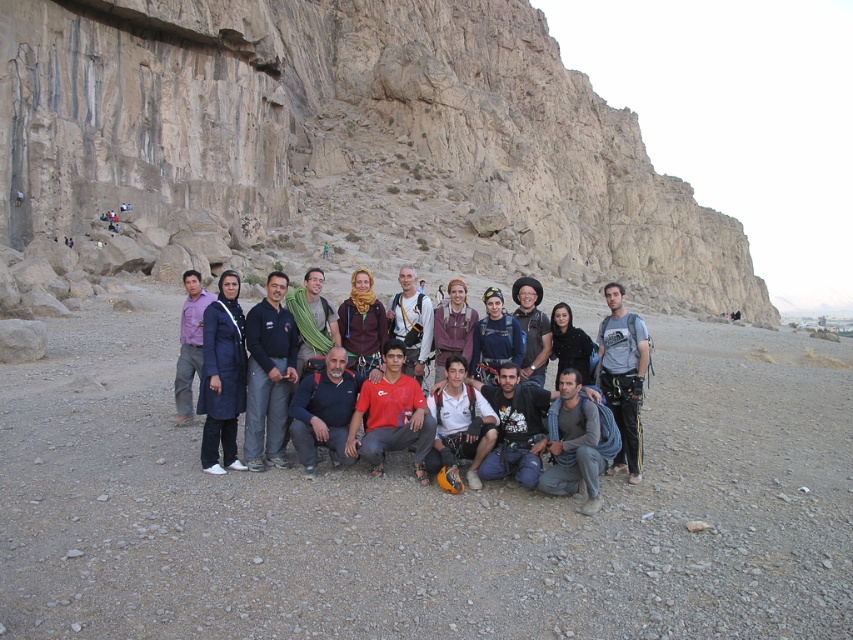
Question: Which point is closer to the camera taking this photo?

Choices:
 (A) (480, 353)
 (B) (204, 305)
 (C) (181, 416)
 (D) (619, 296)

Answer: (C)

Question: Is dark blue fabric shirt at center thinner than brown leather jacket at center?

Choices:
 (A) yes
 (B) no

Answer: (B)

Question: Which is nearer to the green striped scarf at center?

Choices:
 (A) dark blue fleece at center
 (B) dusty gravel desert at center

Answer: (A)

Question: Among these objects, which one is farthest from the camera?

Choices:
 (A) dark blue fabric shirt at center
 (B) matte blue jacket at center
 (C) matte gray backpack at center
 (D) white cotton shirt at center

Answer: (C)

Question: Does matte blue jacket at center appear over red cotton shirt at center?

Choices:
 (A) no
 (B) yes

Answer: (B)

Question: Is the position of red cotton shirt at center less distant than that of gray fabric shirt at lower center?

Choices:
 (A) no
 (B) yes

Answer: (A)